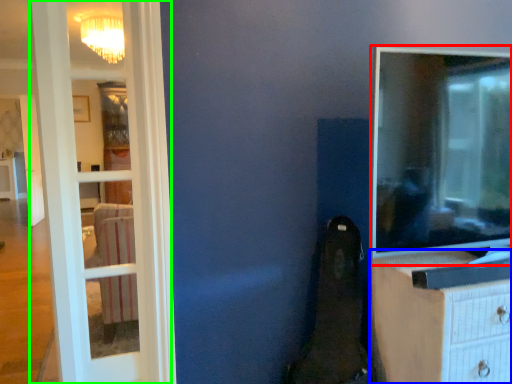
Question: Estimate the real-world distances between objects in this image. Which object is farther from tv show (highlighted by a red box), chest of drawers (highlighted by a blue box) or door (highlighted by a green box)?

Choices:
 (A) chest of drawers
 (B) door

Answer: (B)